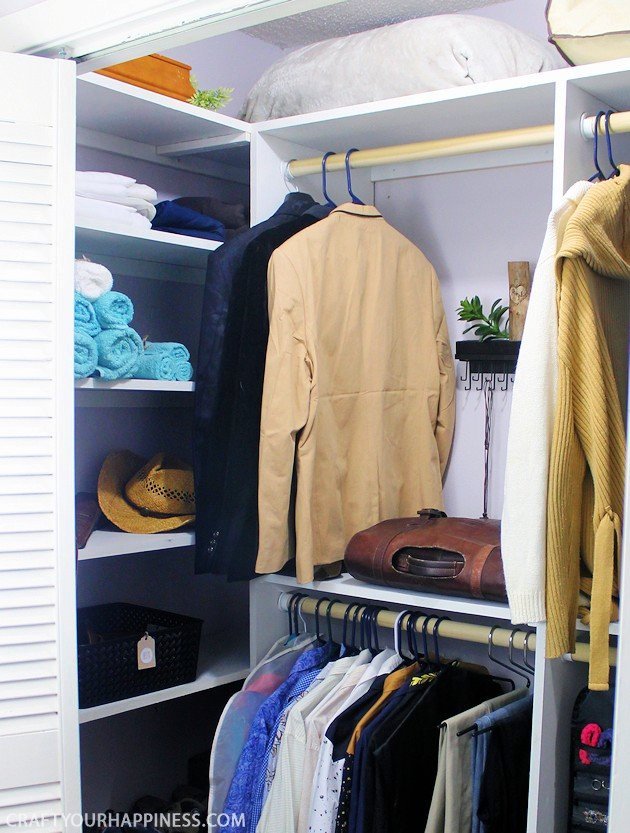
You are a GUI agent. You are given a task and a screenshot of the screen. Output one action in this format:
    pyautogui.click(x=<x>, y=<y>)
    Task: Click on the rolled blue rags
    
    Given the screenshot: What is the action you would take?
    pyautogui.click(x=176, y=352), pyautogui.click(x=183, y=363), pyautogui.click(x=159, y=372)